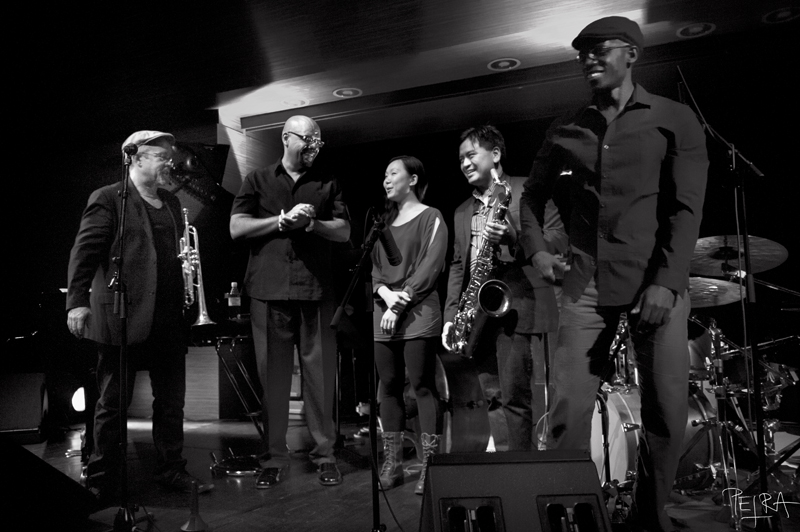
I want to click on stage, so click(272, 506).